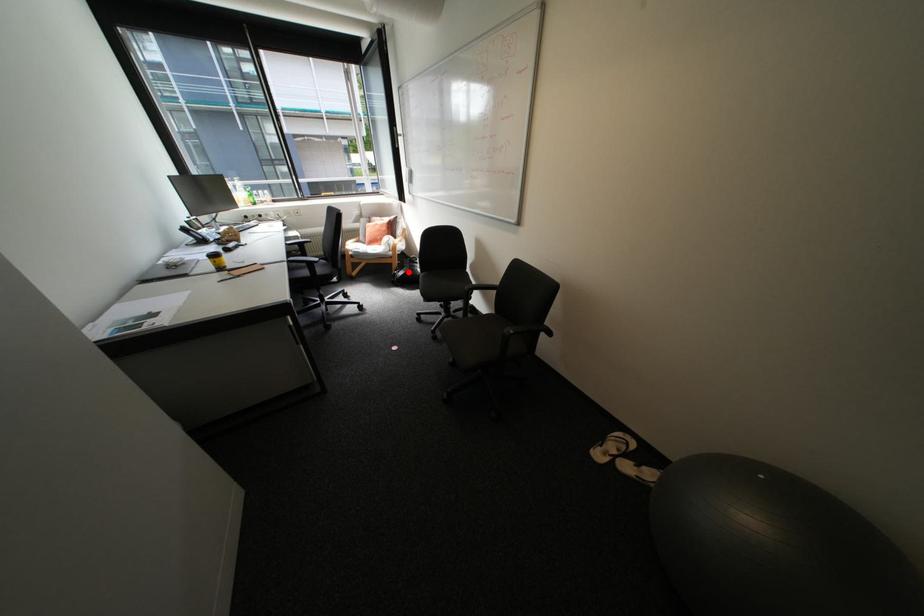
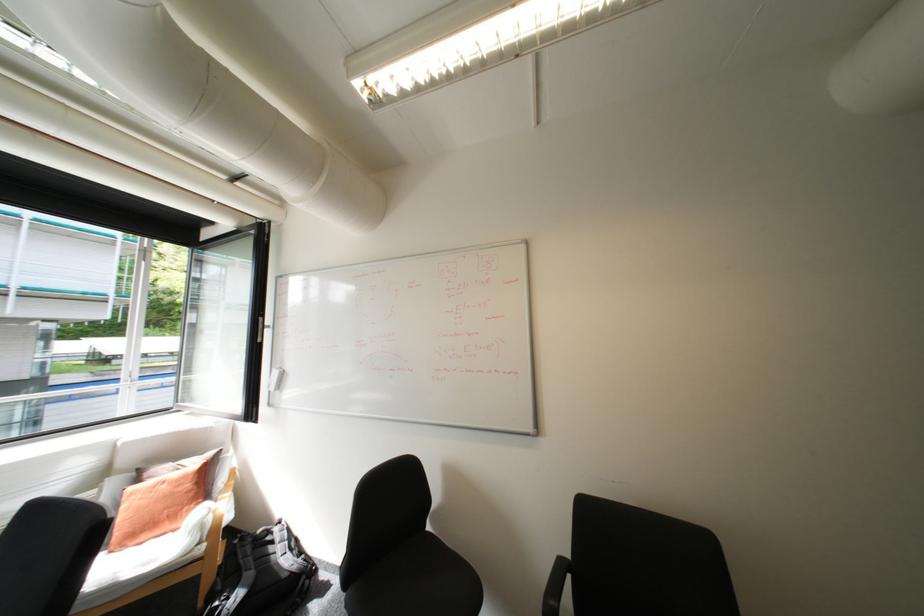
Find the pixel in the second image that matches the highlighted location in the first image.

(238, 599)